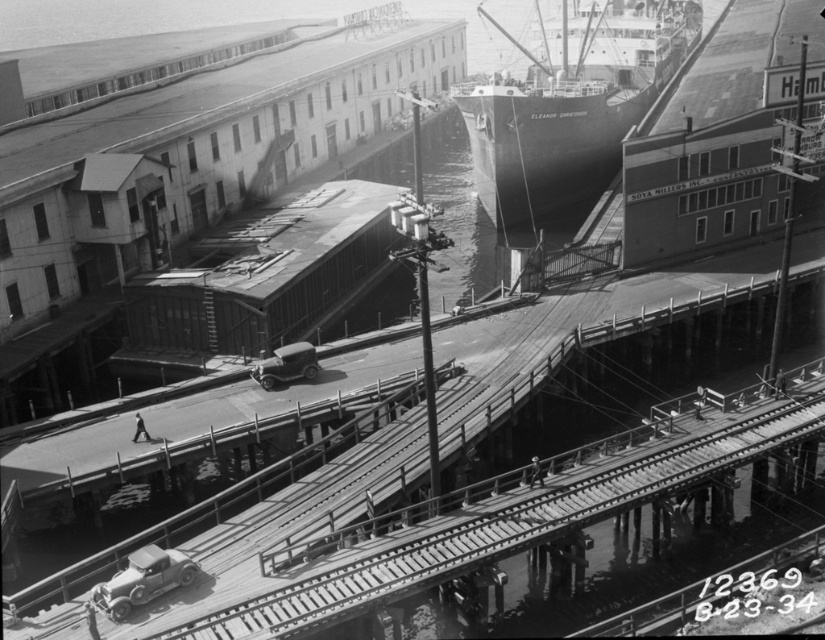
Question: Can you confirm if smooth wooden planks at center is thinner than dark gray matte ship at upper center?

Choices:
 (A) no
 (B) yes

Answer: (B)

Question: Which point is farther to the camera?

Choices:
 (A) (192, 573)
 (B) (514, 106)
 (C) (569, 451)
 (D) (258, 376)

Answer: (B)

Question: Considering the real-world distances, which object is closest to the shiny silver car at center?

Choices:
 (A) smooth wooden planks at center
 (B) dark gray matte ship at upper center

Answer: (A)

Question: Which point is closer to the camera?

Choices:
 (A) smooth wooden planks at center
 (B) dark gray matte ship at upper center

Answer: (A)

Question: Is shiny silver car at lower left above shiny silver car at center?

Choices:
 (A) yes
 (B) no

Answer: (B)

Question: Is shiny silver car at lower left positioned at the back of shiny silver car at center?

Choices:
 (A) yes
 (B) no

Answer: (B)